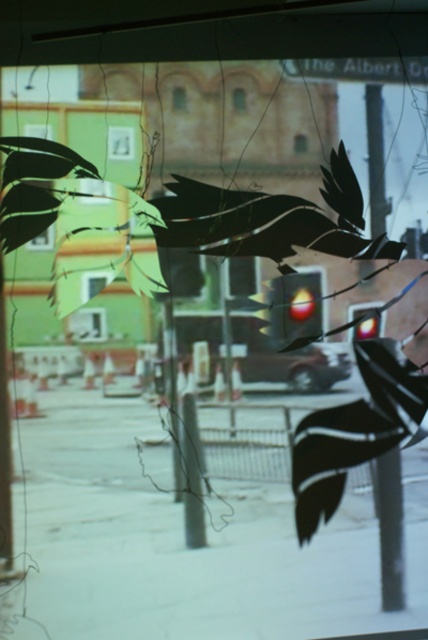
You are looking through the window and see two points marked in the image. Which point is closer to you, point (x=219, y=246) or point (x=400, y=364)?

Point (x=219, y=246) is closer to the viewer than point (x=400, y=364).

You are a photographer trying to capture both the black glossy bird at center and the black glossy bird at lower right in a single shot. Based on their positions, which bird should you focus on first to ensure both are in frame?

The black glossy bird at center is located above the black glossy bird at lower right, so you should focus on the black glossy bird at lower right first to ensure both are in frame.

You are an observer looking through the window. You notice two black glossy birds. Which one is closer to you, the black glossy bird at center or the black glossy bird at lower right?

The black glossy bird at center is closer to you because it appears larger than the black glossy bird at lower right, and in perspective, closer objects appear larger.